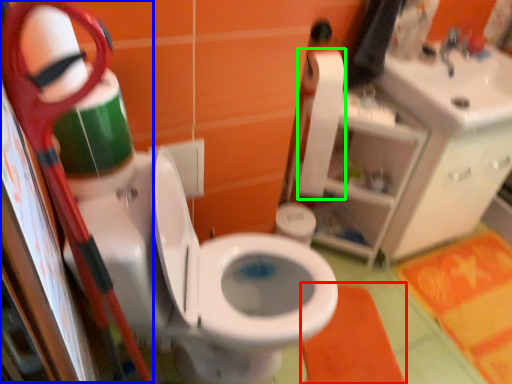
Question: Which object is positioned farthest from bath mat (highlighted by a red box)? Select from scissors (highlighted by a blue box) and toilet paper (highlighted by a green box).

Choices:
 (A) scissors
 (B) toilet paper

Answer: (A)